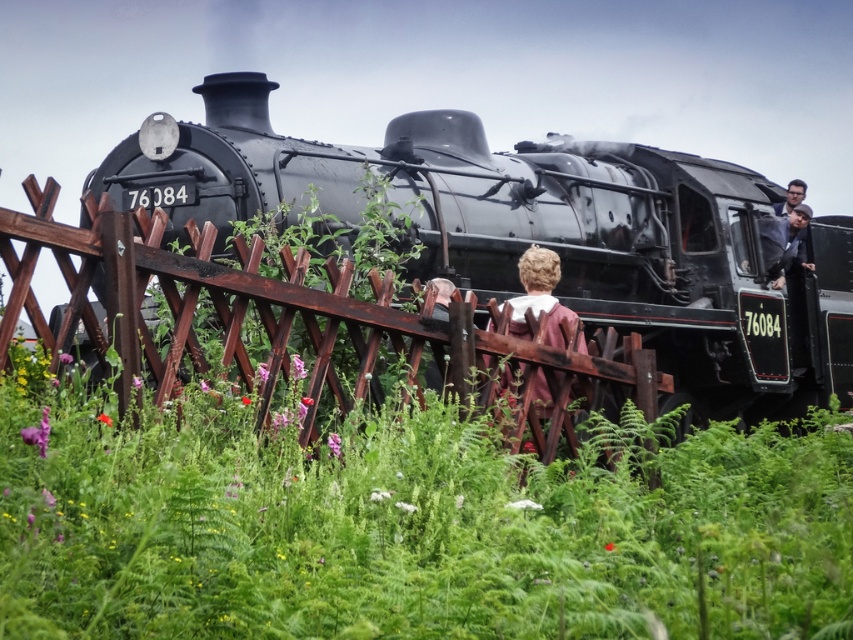
You are standing at the point marked as point (500, 305). The train is 15 meters long. Can you see the entire length of the train from your current position?

The point (500, 305) is 32.97 meters away from the viewer. Since the train is only 15 meters long, you can see the entire length of the train from your current position because the distance is greater than the train length.

You are standing at the point marked by coordinates point (302, 321) in the image. What object are you directly facing?

The point (302, 321) indicates the location of the brown wooden fence at center, so you are directly facing the brown wooden fence at center.